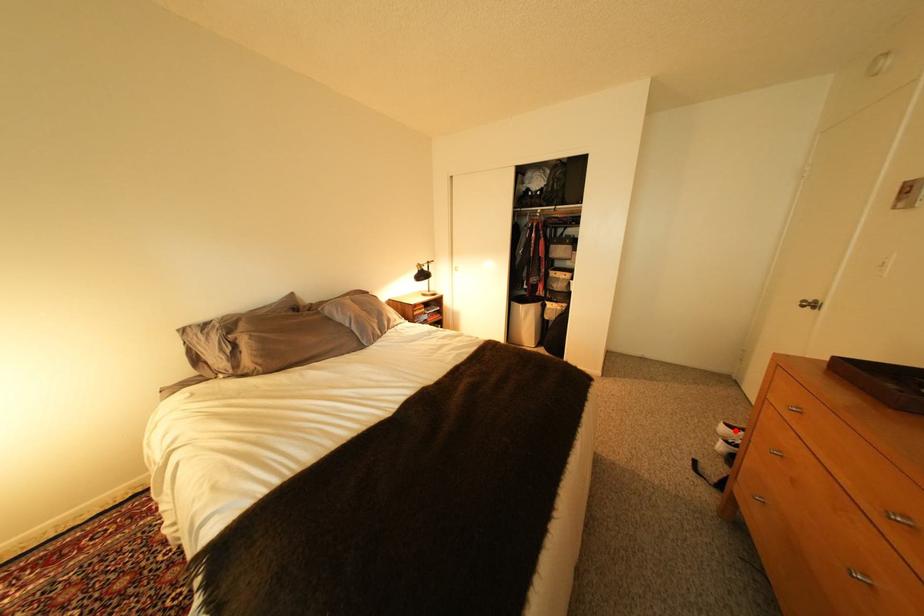
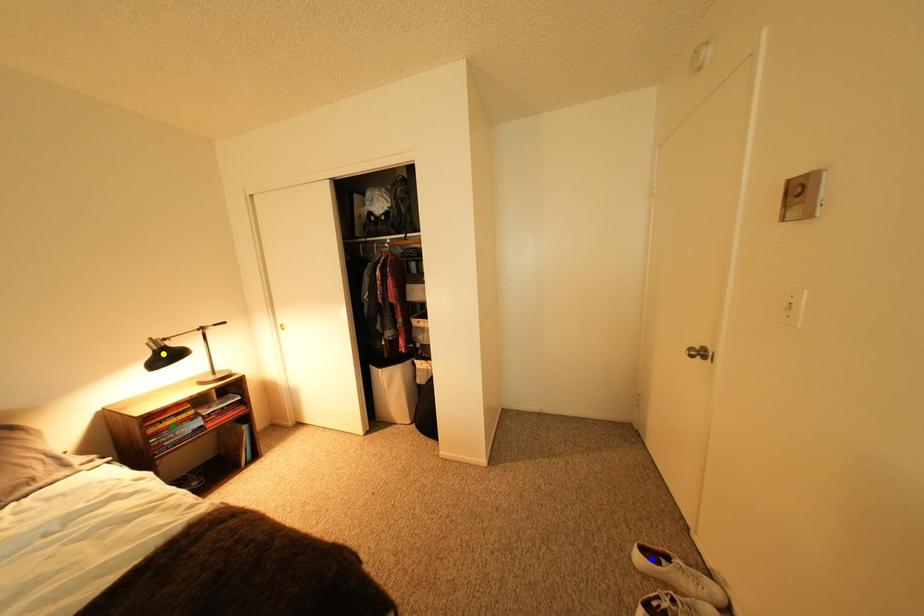
Question: I am providing you with two images of the same scene from different viewpoints. A red point is marked on the first image. You are given multiple points on the second image. Which mark in image 2 goes with the point in image 1?

Choices:
 (A) yellow point
 (B) blue point
 (C) green point

Answer: (B)